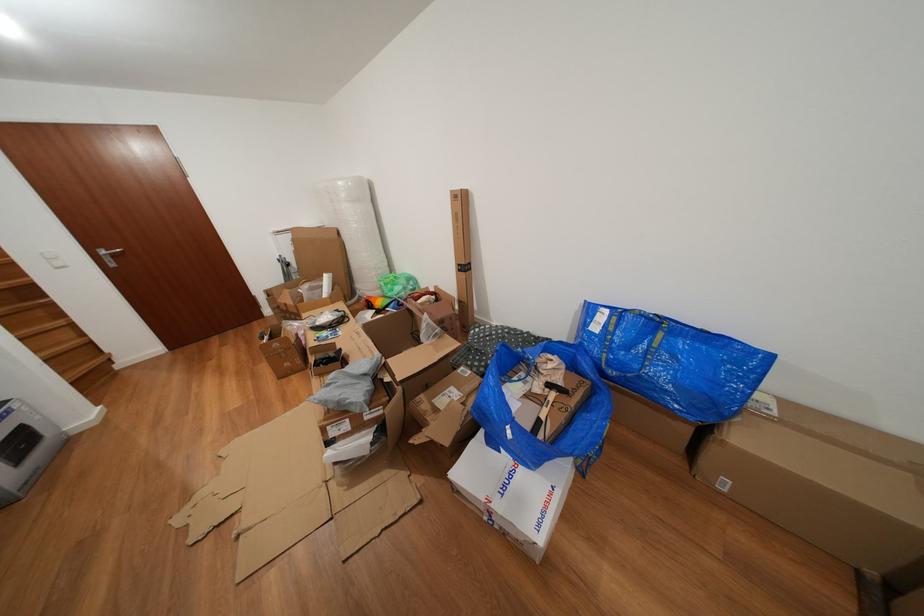
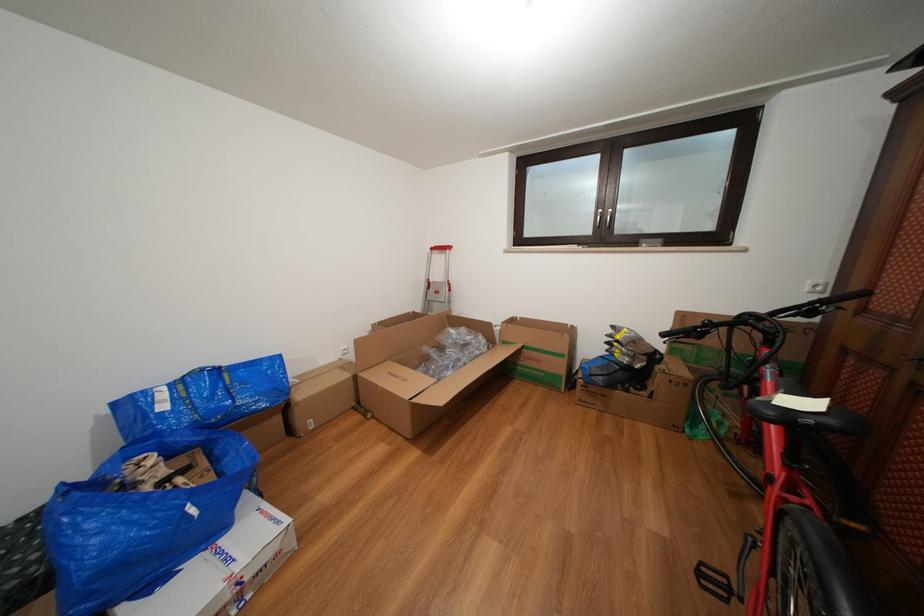
Locate, in the second image, the point that corresponds to the point at 663,328 in the first image.

(225, 376)